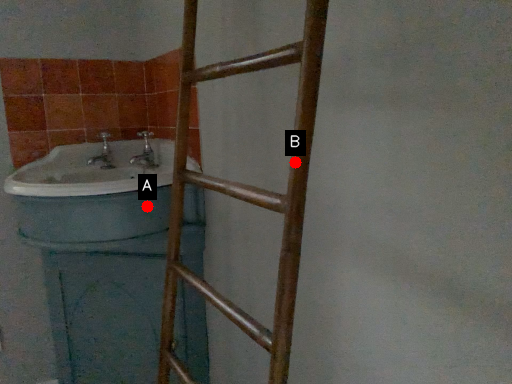
Question: Two points are circled on the image, labeled by A and B beside each circle. Which point is closer to the camera taking this photo?

Choices:
 (A) A is closer
 (B) B is closer

Answer: (B)